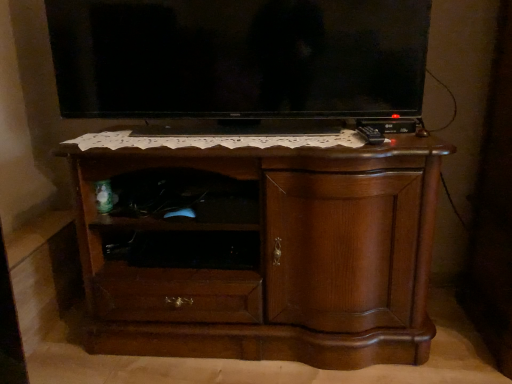
Question: From the image's perspective, is black glossy tv at upper center located beneath black matte shelf at center?

Choices:
 (A) no
 (B) yes

Answer: (A)

Question: Does black glossy tv at upper center appear on the left side of black matte shelf at center?

Choices:
 (A) no
 (B) yes

Answer: (A)

Question: Is black glossy tv at upper center positioned behind black matte shelf at center?

Choices:
 (A) no
 (B) yes

Answer: (A)

Question: Does black glossy tv at upper center have a greater height compared to black matte shelf at center?

Choices:
 (A) yes
 (B) no

Answer: (A)

Question: Is black glossy tv at upper center closer to camera compared to black matte shelf at center?

Choices:
 (A) yes
 (B) no

Answer: (A)

Question: From a real-world perspective, is black glossy tv at upper center under black matte shelf at center?

Choices:
 (A) no
 (B) yes

Answer: (A)

Question: Are black matte shelf at center and brown wood chest of drawers at center located far from each other?

Choices:
 (A) yes
 (B) no

Answer: (B)

Question: Does black matte shelf at center have a smaller size compared to brown wood chest of drawers at center?

Choices:
 (A) no
 (B) yes

Answer: (B)

Question: Is black matte shelf at center thinner than brown wood chest of drawers at center?

Choices:
 (A) yes
 (B) no

Answer: (A)

Question: Is black matte shelf at center oriented away from brown wood chest of drawers at center?

Choices:
 (A) no
 (B) yes

Answer: (B)

Question: Is black matte shelf at center positioned beyond the bounds of brown wood chest of drawers at center?

Choices:
 (A) yes
 (B) no

Answer: (B)

Question: Is black matte shelf at center wider than brown wood chest of drawers at center?

Choices:
 (A) yes
 (B) no

Answer: (B)

Question: Could you tell me if brown wood chest of drawers at center is turned towards black glossy tv at upper center?

Choices:
 (A) yes
 (B) no

Answer: (B)